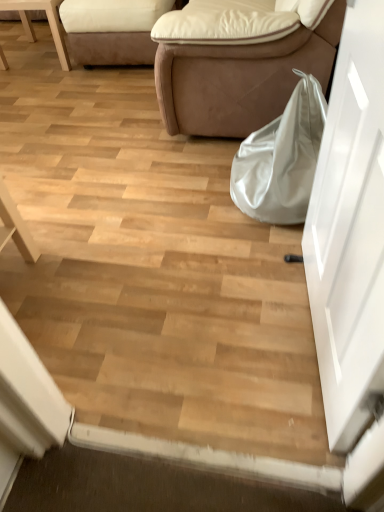
You are a GUI agent. You are given a task and a screenshot of the screen. Output one action in this format:
    pyautogui.click(x=<x>, y=<y>)
    Task: Click on the blank space to the left of white glossy door at right
    
    Given the screenshot: What is the action you would take?
    pyautogui.click(x=203, y=326)